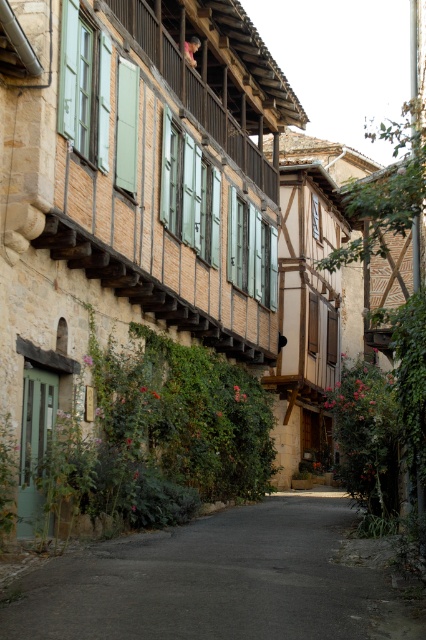
Is point (307, 522) less distant than point (129, 10)?

Yes, it is in front of point (129, 10).

From the picture: Measure the distance between point (219, 614) and camera.

The distance of point (219, 614) from camera is 24.70 feet.

Identify the location of dark asphalt road at center. (218, 580).